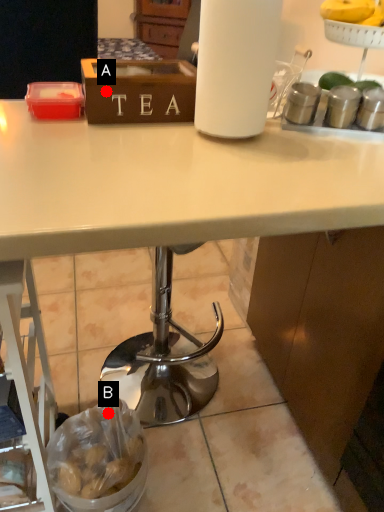
Question: Two points are circled on the image, labeled by A and B beside each circle. Which of the following is the closest to the observer?

Choices:
 (A) A is closer
 (B) B is closer

Answer: (A)